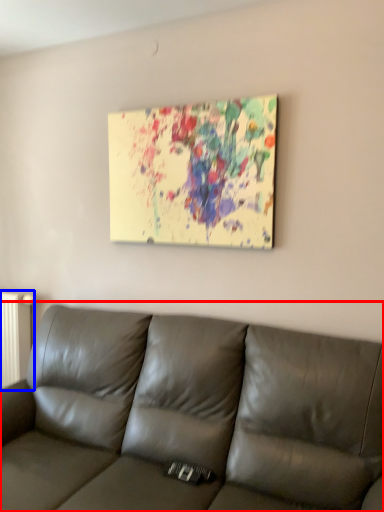
Question: Among these objects, which one is nearest to the camera, studio couch (highlighted by a red box) or radiator (highlighted by a blue box)?

Choices:
 (A) studio couch
 (B) radiator

Answer: (A)